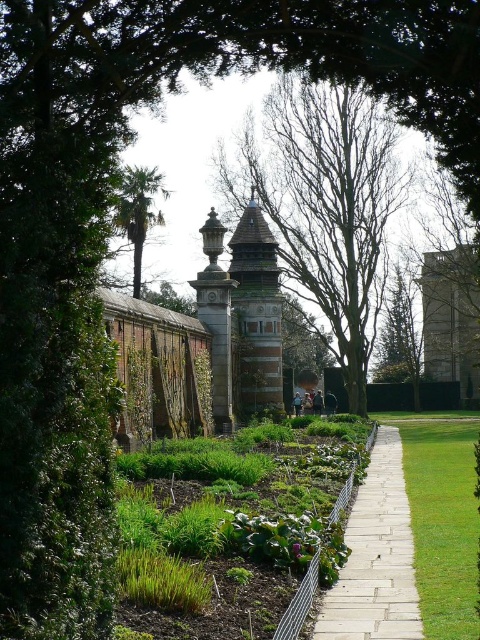
Question: Which of these objects is positioned closest to the white stone path at center?

Choices:
 (A) stone lantern at center
 (B) green leafy garden at center
 (C) green leafy palm at upper left
 (D) bare wood tree at center

Answer: (B)

Question: Does green leafy garden at center appear under green leafy tree at center?

Choices:
 (A) no
 (B) yes

Answer: (B)

Question: Does green leafy garden at center have a larger size compared to green leafy palm at upper left?

Choices:
 (A) yes
 (B) no

Answer: (B)

Question: Estimate the real-world distances between objects in this image. Which object is farther from the stone lantern at center?

Choices:
 (A) green leafy tree at center
 (B) green leafy garden at center
 (C) bare wood tree at center
 (D) brown stone tower at center

Answer: (A)

Question: Is green leafy garden at center thinner than white stone path at center?

Choices:
 (A) no
 (B) yes

Answer: (A)

Question: Which object is the closest to the green leafy tree at center?

Choices:
 (A) green leafy garden at center
 (B) brown stone tower at center
 (C) bare wood tree at center
 (D) green leafy palm at upper left

Answer: (C)